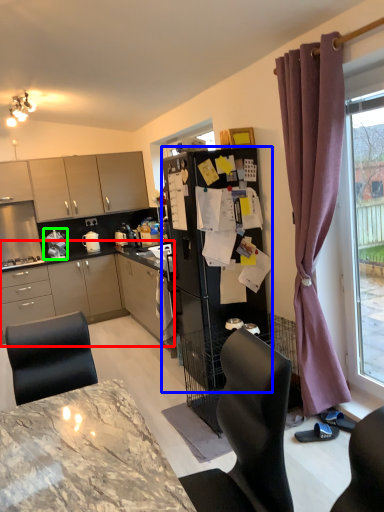
Question: Based on their relative distances, which object is farther from cabinetry (highlighted by a red box)? Choose from refrigerator (highlighted by a blue box) and appliance (highlighted by a green box).

Choices:
 (A) refrigerator
 (B) appliance

Answer: (A)